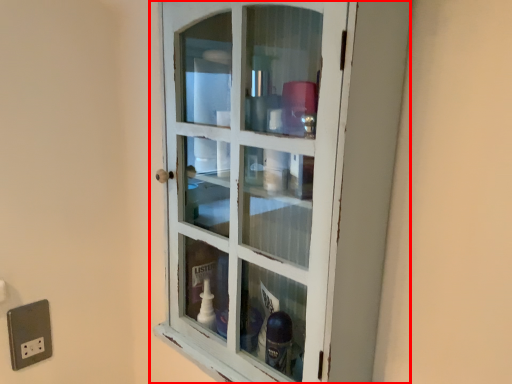
Question: From the image's perspective, where is cupboard (annotated by the red box) located in relation to electric outlet in the image?

Choices:
 (A) below
 (B) above

Answer: (B)